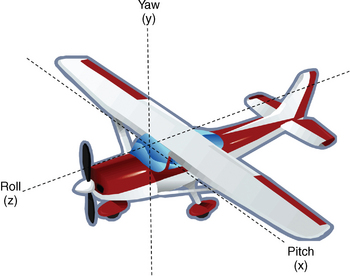
The image size is (350, 276). I want to click on red frame, so click(120, 174).